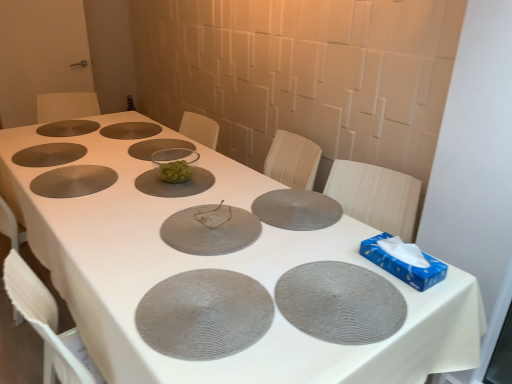
The height and width of the screenshot is (384, 512). In order to click on vacant space underneath matte gray glass plate at upper left, the 10th glass plate positioned from the front (from a real-world perspective) in this screenshot , I will do `click(70, 124)`.